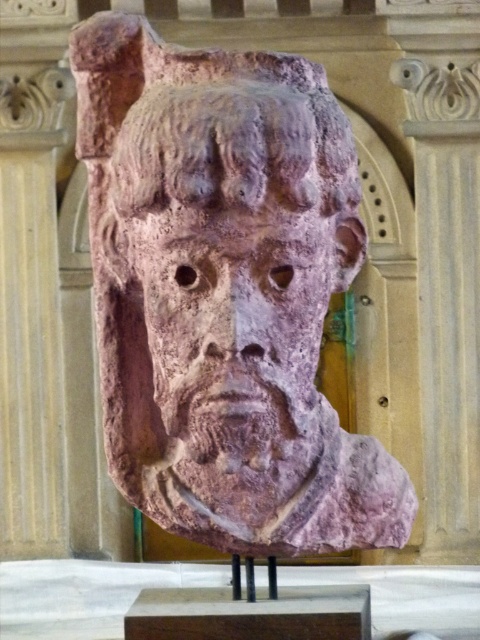
You are an art conservator examining the rustic stone mask at center and the rustic stone face at center displayed in the museum. Which object has a greater width according to the description?

The rustic stone mask at center might be wider than rustic stone face at center according to the description.

You are standing in front of the stone sculpture and want to place a small decorative item exactly at the point labeled point [91,122]. If your hand can reach up to 1.2 meters from your body, will you be able to reach that point?

The distance between you and point [91,122] is 1.36 meters, which is beyond your hand reach of 1.2 meters. Therefore, you cannot reach the point.

You are an art conservator examining the sculpture. You notice two features at the center of the sculpture. One is the rustic stone mask at center and the other is the rustic stone face at center. Which one is positioned higher up?

The rustic stone mask at center is located above the rustic stone face at center, so it is positioned higher up.